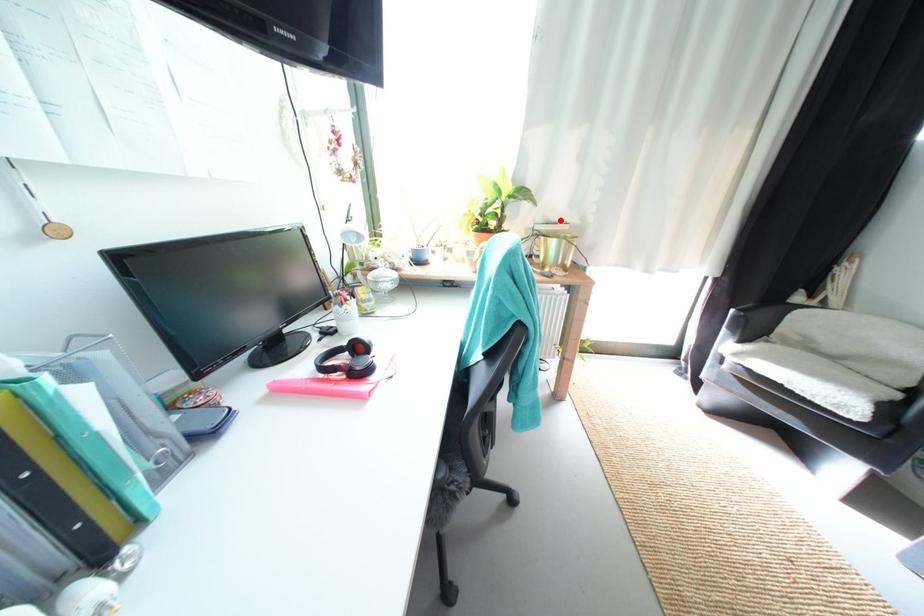
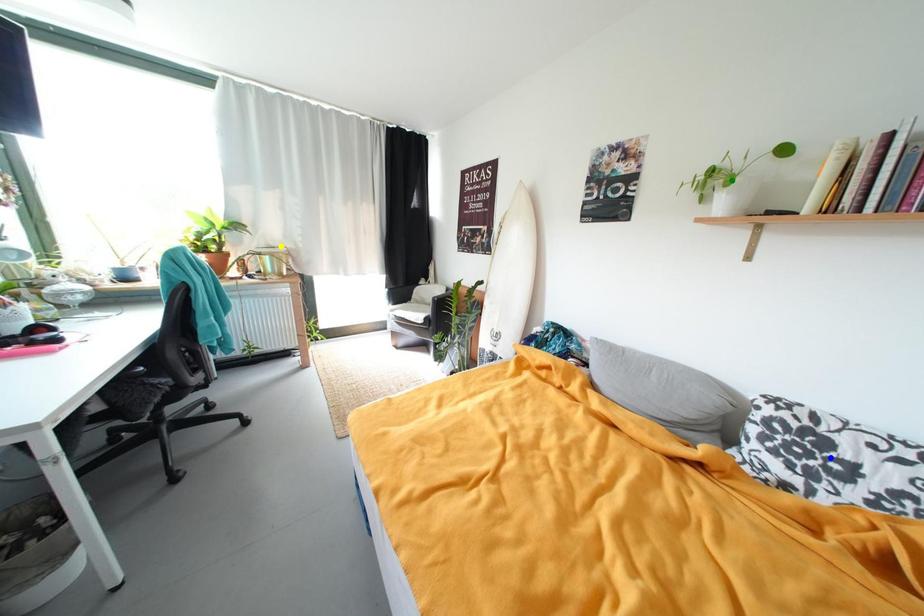
Question: I am providing you with two images of the same scene from different viewpoints. A red point is marked on the first image. You are given multiple points on the second image. Can you choose the point in image 2 that corresponds to the point in image 1?

Choices:
 (A) green point
 (B) yellow point
 (C) blue point

Answer: (B)